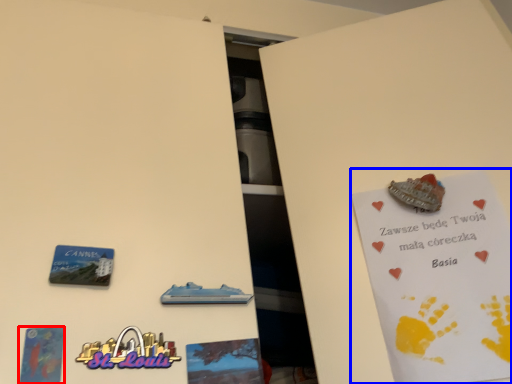
Question: Among these objects, which one is nearest to the camera, postcard (highlighted by a red box) or postcard (highlighted by a blue box)?

Choices:
 (A) postcard
 (B) postcard

Answer: (A)